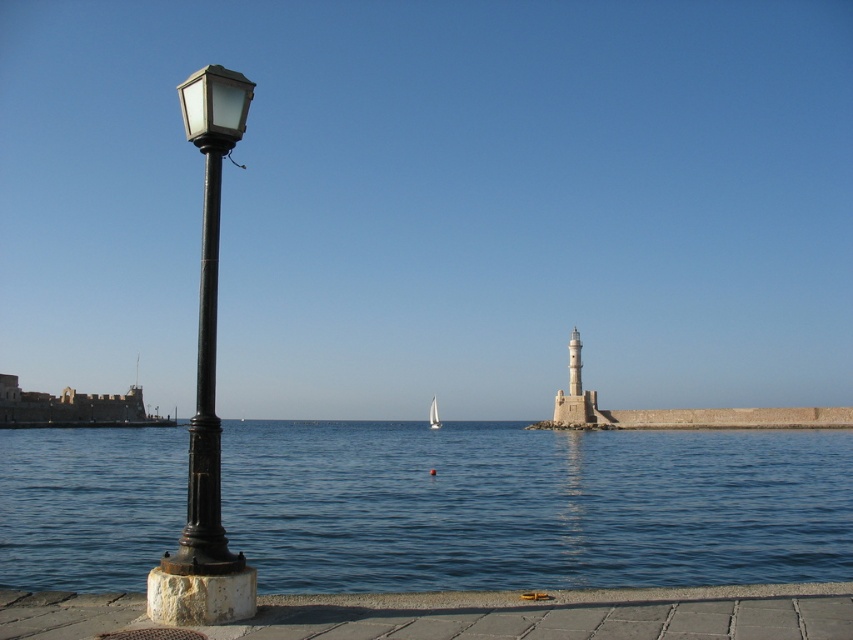
This screenshot has width=853, height=640. Describe the element at coordinates (213, 108) in the screenshot. I see `matte glass streetlamp at left` at that location.

Is matte glass streetlamp at left positioned behind white sailboat at center?

No.

Which is in front, point (201, 145) or point (436, 413)?

Point (201, 145) is more forward.

Image resolution: width=853 pixels, height=640 pixels. Find the location of `matte glass streetlamp at left`. matte glass streetlamp at left is located at coordinates (213, 108).

Who is positioned more to the right, blue water at lower left or white sailboat at center?

blue water at lower left is more to the right.

Locate an element on the screen. This screenshot has height=640, width=853. blue water at lower left is located at coordinates (532, 506).

Which is in front, point (340, 566) or point (438, 417)?

Point (340, 566) is in front.

Image resolution: width=853 pixels, height=640 pixels. What are the coordinates of `blue water at lower left` in the screenshot? It's located at (532, 506).

Is blue water at lower left above matte black street light at left?

Incorrect, blue water at lower left is not positioned above matte black street light at left.

Is blue water at lower left thinner than matte black street light at left?

No, blue water at lower left is not thinner than matte black street light at left.

Who is more distant from viewer, (509,564) or (148,608)?

The point (509,564) is more distant.

Find the location of a particular element. This screenshot has width=853, height=640. blue water at lower left is located at coordinates (532, 506).